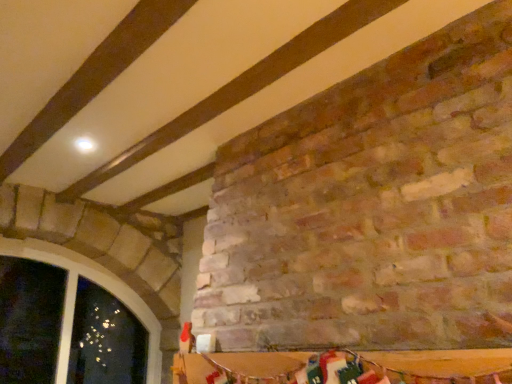
Question: In the image, is matte stone window at lower left positioned in front of or behind wooden table at lower center?

Choices:
 (A) front
 (B) behind

Answer: (B)

Question: Visually, is matte stone window at lower left positioned to the left or to the right of wooden table at lower center?

Choices:
 (A) right
 (B) left

Answer: (B)

Question: Do you think matte stone window at lower left is within wooden table at lower center, or outside of it?

Choices:
 (A) outside
 (B) inside

Answer: (A)

Question: In the image, is wooden table at lower center positioned in front of or behind matte stone window at lower left?

Choices:
 (A) front
 (B) behind

Answer: (A)

Question: Considering the positions of wooden table at lower center and matte stone window at lower left in the image, is wooden table at lower center taller or shorter than matte stone window at lower left?

Choices:
 (A) short
 (B) tall

Answer: (A)

Question: Considering the positions of wooden table at lower center and matte stone window at lower left in the image, is wooden table at lower center wider or thinner than matte stone window at lower left?

Choices:
 (A) wide
 (B) thin

Answer: (B)

Question: From the image's perspective, is wooden table at lower center located above or below matte stone window at lower left?

Choices:
 (A) above
 (B) below

Answer: (A)